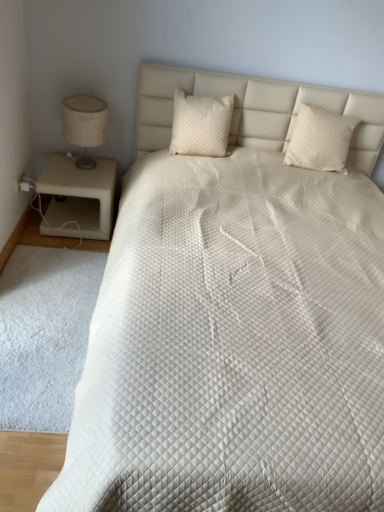
Question: From a real-world perspective, is white quilted pillow at center, marked as the 2th pillow in a right-to-left arrangement, positioned above or below beige matte nightstand at left?

Choices:
 (A) below
 (B) above

Answer: (B)

Question: Considering the relative positions of white quilted pillow at center, marked as the 2th pillow in a right-to-left arrangement, and beige matte nightstand at left in the image provided, is white quilted pillow at center, marked as the 2th pillow in a right-to-left arrangement, to the left or to the right of beige matte nightstand at left?

Choices:
 (A) left
 (B) right

Answer: (B)

Question: Estimate the real-world distances between objects in this image. Which object is closer to the white fluffy rug at lower left?

Choices:
 (A) beige fabric lampshade at left
 (B) white quilted pillow at center, marked as the 2th pillow in a right-to-left arrangement
 (C) beige matte nightstand at left
 (D) white quilted pillow at center, which is the first pillow from right to left

Answer: (C)

Question: Which is farther from the white fluffy rug at lower left?

Choices:
 (A) white quilted pillow at center, marked as the 2th pillow in a left-to-right arrangement
 (B) white quilted pillow at center, which is the 1th pillow in left-to-right order
 (C) beige matte nightstand at left
 (D) beige fabric lampshade at left

Answer: (A)